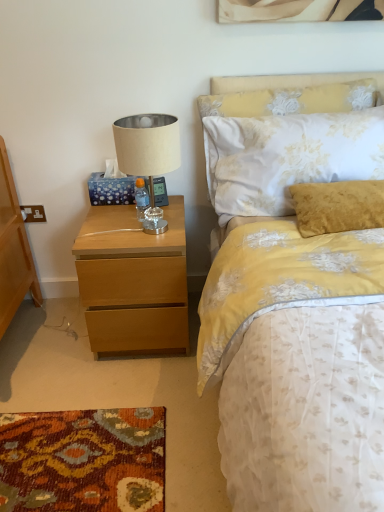
What are the coordinates of `free point to the left of beige fabric lampshade at upper left` in the screenshot? It's located at (101, 230).